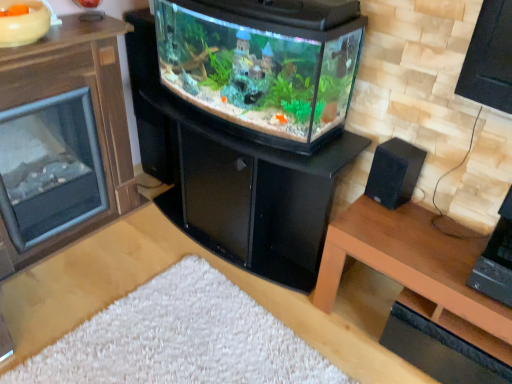
Question: Is black glossy fireplace at center in front of black matte speaker at right?

Choices:
 (A) no
 (B) yes

Answer: (B)

Question: Does black glossy fireplace at center appear on the left side of black matte speaker at right?

Choices:
 (A) yes
 (B) no

Answer: (A)

Question: Is black glossy fireplace at center turned away from black matte speaker at right?

Choices:
 (A) no
 (B) yes

Answer: (A)

Question: Does black glossy fireplace at center turn towards black matte speaker at right?

Choices:
 (A) no
 (B) yes

Answer: (A)

Question: Can you confirm if black glossy fireplace at center is taller than black matte speaker at right?

Choices:
 (A) yes
 (B) no

Answer: (A)

Question: In the image, is black glossy fireplace at center positioned in front of or behind brown wood fireplace at left?

Choices:
 (A) front
 (B) behind

Answer: (B)

Question: Choose the correct answer: Is black glossy fireplace at center inside brown wood fireplace at left or outside it?

Choices:
 (A) inside
 (B) outside

Answer: (B)

Question: In terms of height, does black glossy fireplace at center look taller or shorter compared to brown wood fireplace at left?

Choices:
 (A) tall
 (B) short

Answer: (B)

Question: Is black glossy fireplace at center wider or thinner than brown wood fireplace at left?

Choices:
 (A) wide
 (B) thin

Answer: (A)

Question: Is brown wood fireplace at left taller or shorter than black matte speaker at right?

Choices:
 (A) short
 (B) tall

Answer: (B)

Question: Is brown wood fireplace at left in front of or behind black matte speaker at right in the image?

Choices:
 (A) behind
 (B) front

Answer: (B)

Question: From the image's perspective, is brown wood fireplace at left above or below black matte speaker at right?

Choices:
 (A) below
 (B) above

Answer: (B)

Question: Is brown wood fireplace at left wider or thinner than black matte speaker at right?

Choices:
 (A) thin
 (B) wide

Answer: (B)

Question: Based on their sizes in the image, would you say black matte speaker at right is bigger or smaller than black glossy fireplace at center?

Choices:
 (A) small
 (B) big

Answer: (A)

Question: Choose the correct answer: Is black matte speaker at right inside black glossy fireplace at center or outside it?

Choices:
 (A) outside
 (B) inside

Answer: (A)